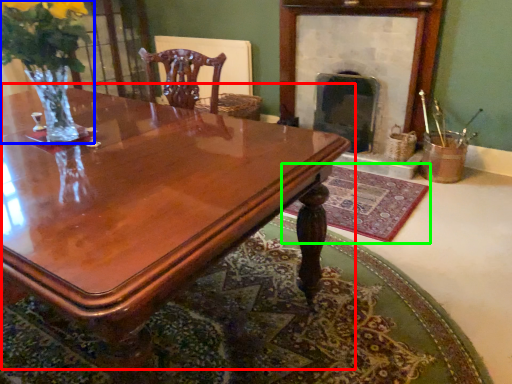
Question: Which object is the closest to the coffee table (highlighted by a red box)? Choose among these: floral arrangement (highlighted by a blue box) or mat (highlighted by a green box).

Choices:
 (A) floral arrangement
 (B) mat

Answer: (A)